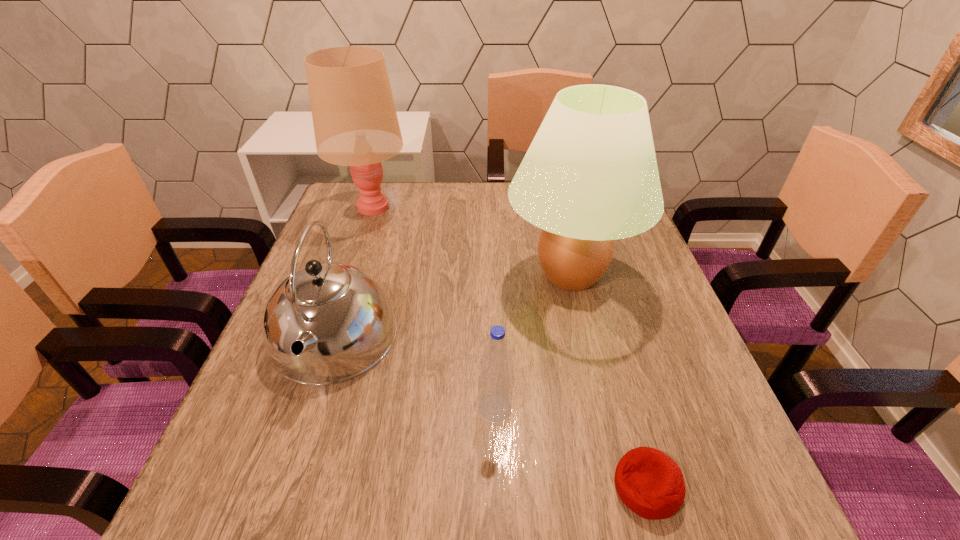
Find the location of `the right lampshade`. the right lampshade is located at coordinates (590, 176).

I want to click on the farthest object, so click(355, 122).

You are a GUI agent. You are given a task and a screenshot of the screen. Output one action in this format:
    pyautogui.click(x=<x>, y=<y>)
    Task: Click on the left lampshade
    The height and width of the screenshot is (540, 960).
    Given the screenshot: What is the action you would take?
    pyautogui.click(x=355, y=122)

You are a GUI agent. You are given a task and a screenshot of the screen. Output one action in this format:
    pyautogui.click(x=<x>, y=<y>)
    Task: Click on the third tallest object
    
    Given the screenshot: What is the action you would take?
    (327, 323)

Where is `water bottle`? The image size is (960, 540). water bottle is located at coordinates (495, 388).

Identify the location of the third object from right to left. (495, 388).

I want to click on beanbag, so click(x=650, y=483).

I want to click on the nearest object, so click(650, 483).

Locate an element on the screen. The height and width of the screenshot is (540, 960). vacant space located on the shade of the right lampshade is located at coordinates (439, 275).

Find the location of a particular element. The width and height of the screenshot is (960, 540). free space located on the shade of the right lampshade is located at coordinates (463, 275).